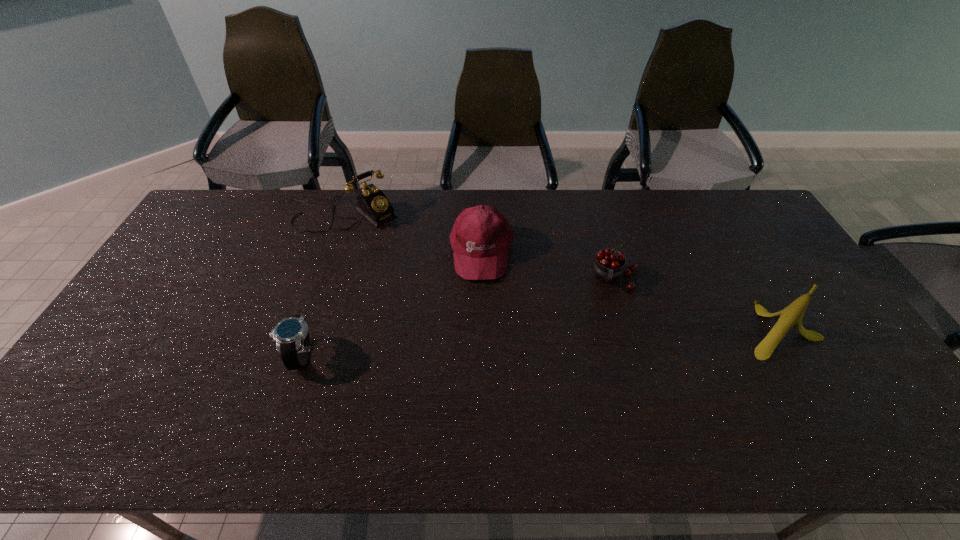
The image size is (960, 540). Find the location of `the shortest object`. the shortest object is located at coordinates pos(291,335).

Where is `the rightmost object`? the rightmost object is located at coordinates (790, 317).

Identify the location of telephone. (372, 203).

Identify the location of the fourth object from left to right. (608, 267).

Identify the location of the third object from left to right. (481, 236).

At what (x,y) coordinates should I click in order to perform the action: click on free space located 0.270m on the right of the watch. Please return your answer as a coordinate pair (x, y). The width and height of the screenshot is (960, 540). Looking at the image, I should click on (420, 355).

Identify the location of vacant point located on the left of the banana. (668, 329).

At what (x,y) coordinates should I click in order to perform the action: click on vacant area located on the dial of the telephone. Please return your answer as a coordinate pair (x, y). Looking at the image, I should click on (431, 276).

Locate an element on the screen. This screenshot has height=540, width=960. vacant region located on the dial of the telephone is located at coordinates (416, 262).

Identify the location of free space located 0.170m on the dial of the telephone. (407, 254).